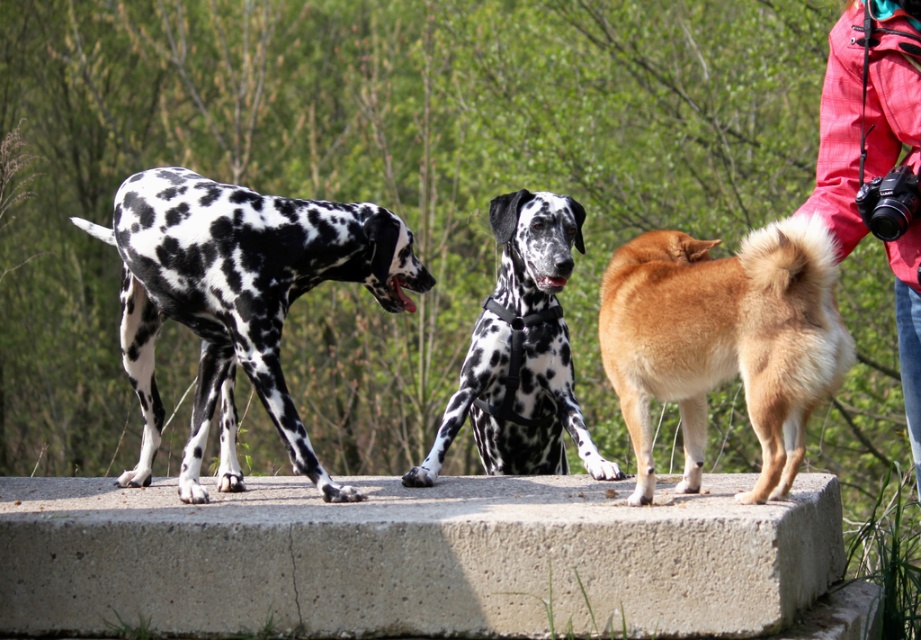
You are standing at the center of the image and want to find the black and white spotted dog at left. In which direction should you look relative to your current position?

The black and white spotted dog at left is located at point (239, 300), so you should look to the left side of the image to find it.

You are a photographer trying to capture a clear shot of both the golden fur dog at center and the spotted fur harness at center. Which one will appear larger in your photo?

The golden fur dog at center will appear larger in the photo because it is closer to the viewer than the spotted fur harness at center.

You are a dog owner who wants to ensure your dog can comfortably wear the harness. Based on the scene, can the golden fur dog at center wear the spotted fur harness at center?

The golden fur dog at center is not as tall as the spotted fur harness at center, so the harness is likely too large for the dog to wear comfortably.